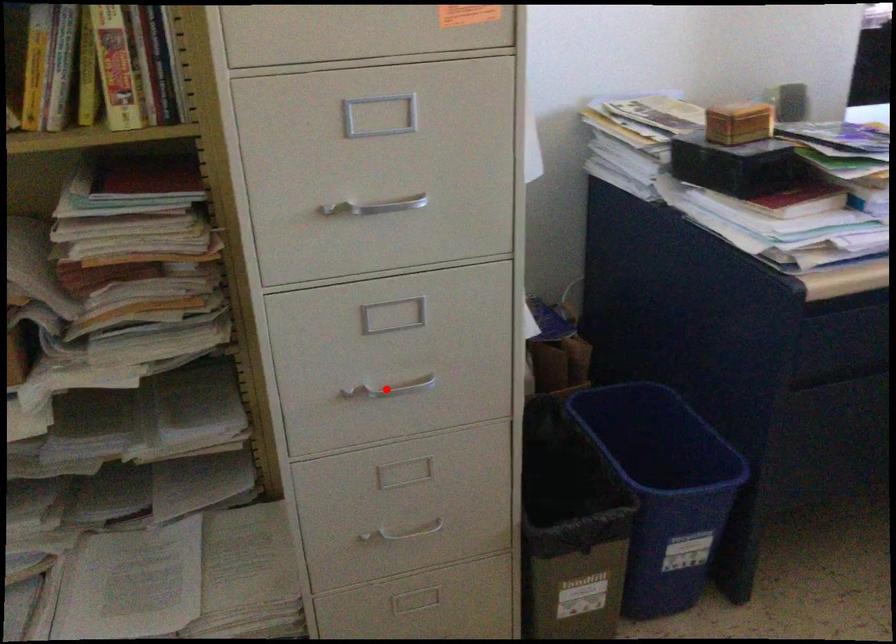
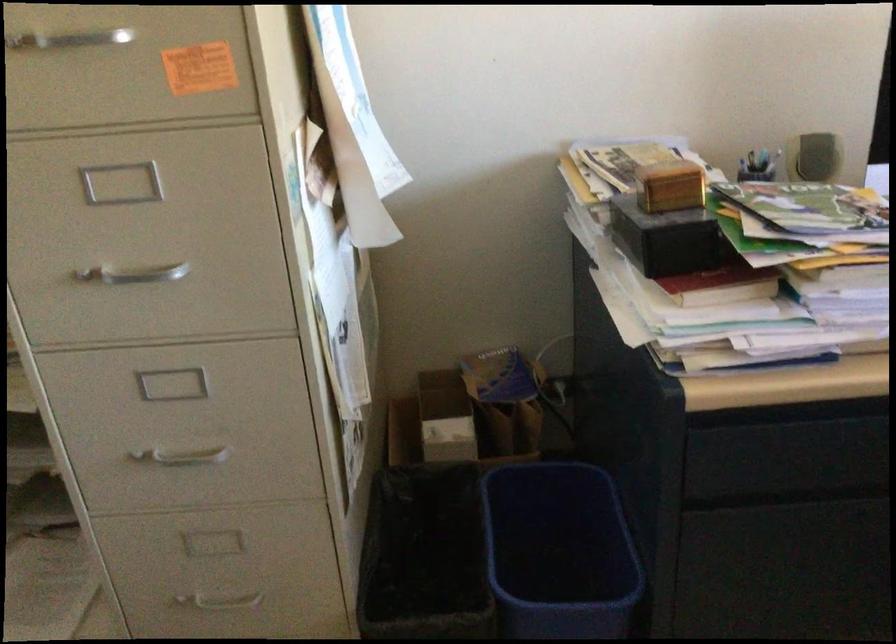
Where in the second image is the point corresponding to the highlighted location from the first image?

(181, 456)